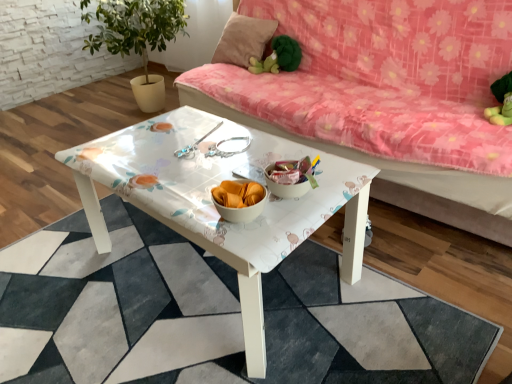
Question: Is white glossy coffee table at center in front of or behind pink fabric pillow at upper center in the image?

Choices:
 (A) front
 (B) behind

Answer: (A)

Question: Is white glossy coffee table at center to the left or to the right of pink fabric pillow at upper center in the image?

Choices:
 (A) right
 (B) left

Answer: (B)

Question: Considering the real-world distances, which object is closest to the floral fabric couch at upper center?

Choices:
 (A) white glossy table at center
 (B) green plush toy at upper center
 (C) pink fabric pillow at upper center
 (D) white glossy coffee table at center

Answer: (B)

Question: Estimate the real-world distances between objects in this image. Which object is farther from the white glossy coffee table at center?

Choices:
 (A) green plush toy at upper center
 (B) pink fabric pillow at upper center
 (C) white glossy table at center
 (D) floral fabric couch at upper center

Answer: (B)